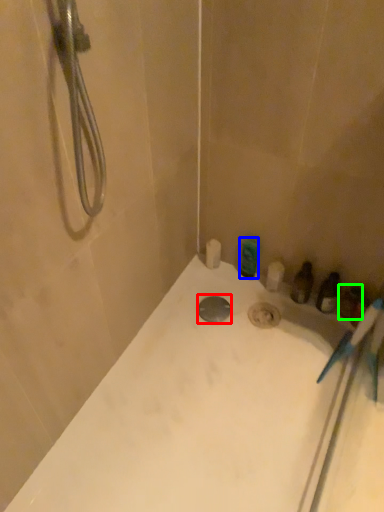
Question: Estimate the real-world distances between objects in this image. Which object is farther from drain (highlighted by a red box), toiletry (highlighted by a blue box) or toiletry (highlighted by a green box)?

Choices:
 (A) toiletry
 (B) toiletry

Answer: (B)